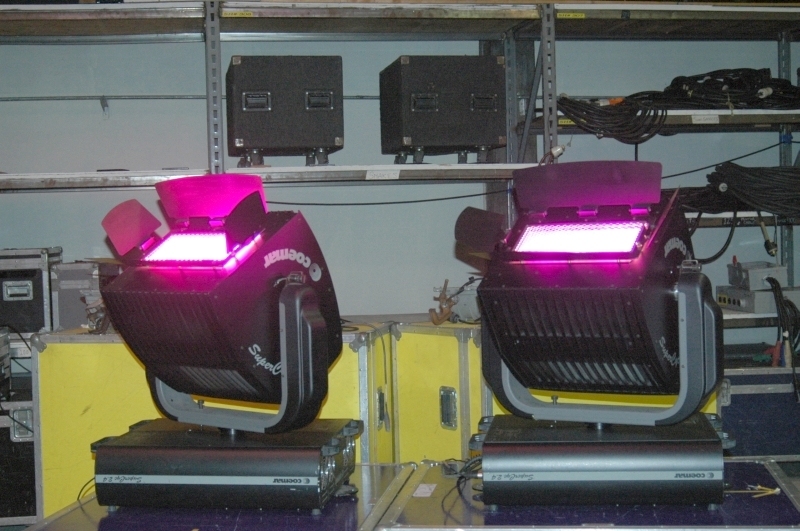
This screenshot has width=800, height=531. In order to click on metal shelf in this screenshot , I will do `click(80, 176)`, `click(357, 175)`, `click(704, 119)`, `click(721, 221)`.